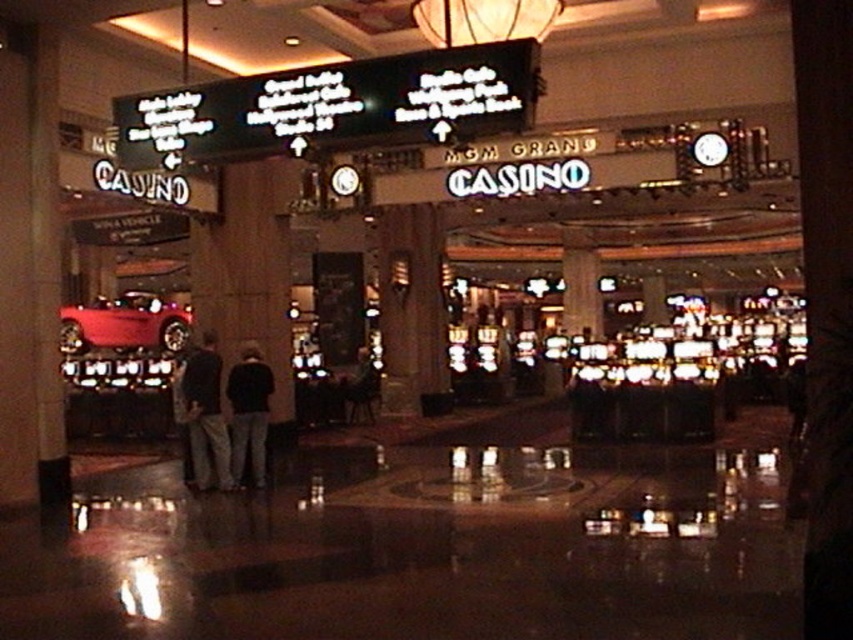
Question: Which point appears farthest from the camera in this image?

Choices:
 (A) (247, 432)
 (B) (137, 314)
 (C) (223, 438)

Answer: (B)

Question: Which of these objects is positioned closest to the shiny red car at left?

Choices:
 (A) dark clothing at center
 (B) dark fabric pants at center

Answer: (A)

Question: Does dark clothing at center appear over dark fabric pants at center?

Choices:
 (A) yes
 (B) no

Answer: (A)

Question: Observing the image, what is the correct spatial positioning of dark clothing at center in reference to dark fabric pants at center?

Choices:
 (A) below
 (B) above

Answer: (B)

Question: Considering the real-world distances, which object is closest to the shiny red car at left?

Choices:
 (A) dark fabric pants at center
 (B) dark clothing at center

Answer: (B)

Question: Can you confirm if dark clothing at center is positioned to the left of dark fabric pants at center?

Choices:
 (A) no
 (B) yes

Answer: (B)